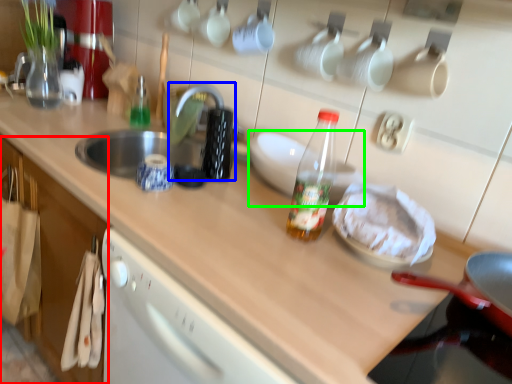
Question: Based on their relative distances, which object is nearer to cabinetry (highlighted by a red box)? Choose from faucet (highlighted by a blue box) and appliance (highlighted by a green box).

Choices:
 (A) faucet
 (B) appliance

Answer: (A)